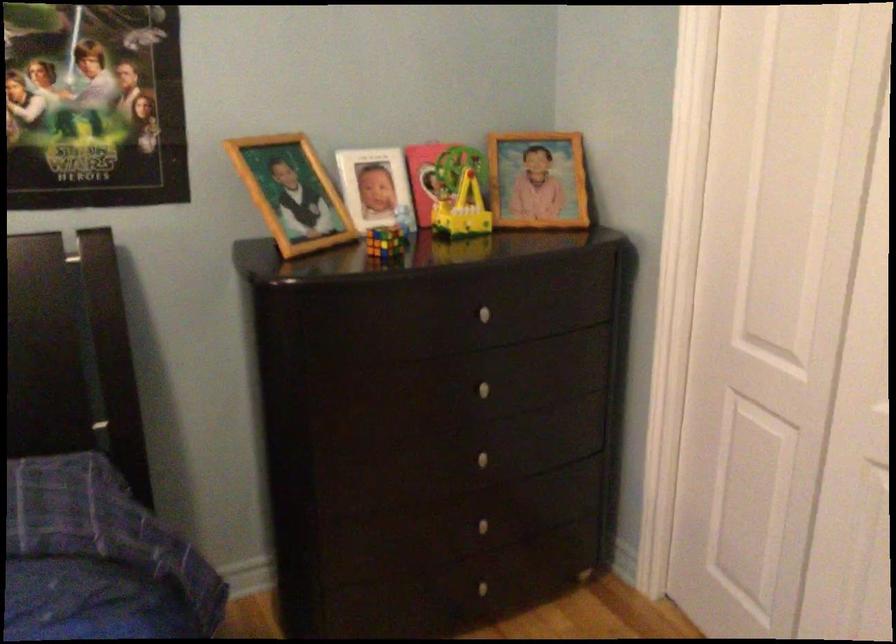
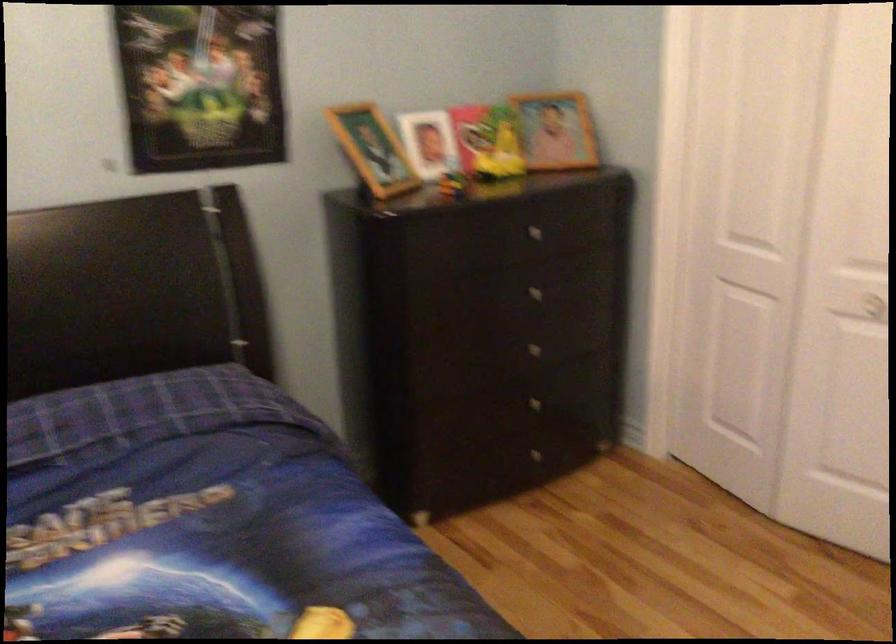
In the second image, find the point that corresponds to point 493,390 in the first image.

(538, 292)